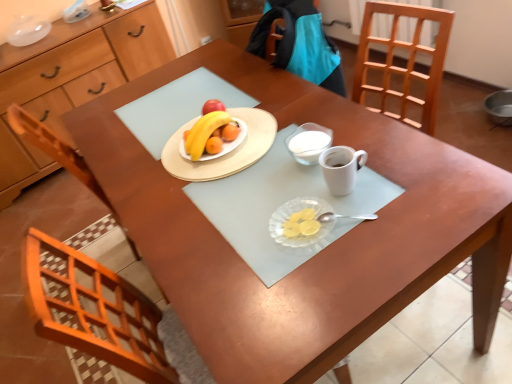
Where is `free space in front of transparent glass plate at center`? The height and width of the screenshot is (384, 512). free space in front of transparent glass plate at center is located at coordinates (319, 282).